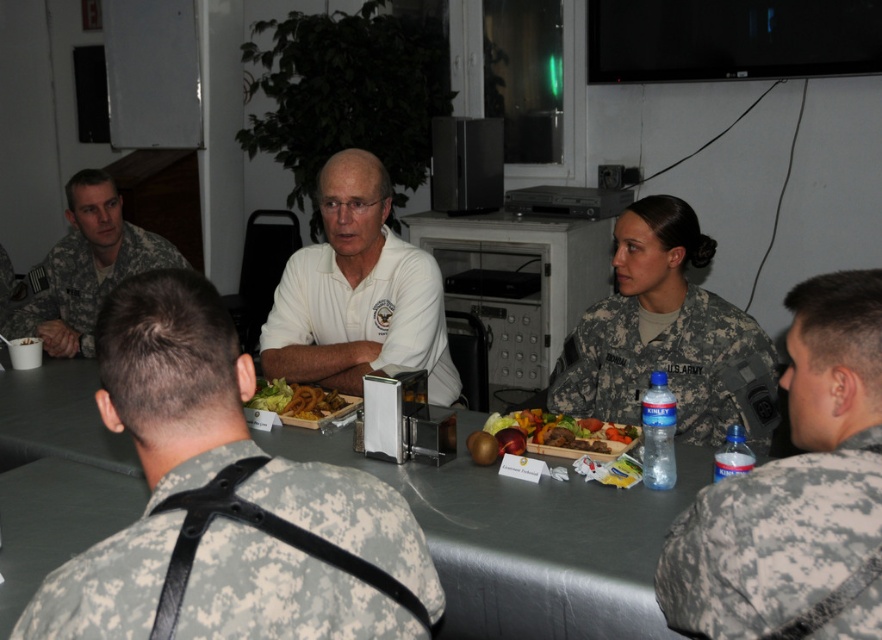
You are a photographer positioned to the side of the table. You need to capture a photo where both the camouflage fabric uniform at left and the golden crispy fries at center are clearly visible. Considering their heights, which object should be placed closer to the camera to ensure both are in focus?

The camouflage fabric uniform at left is taller than the golden crispy fries at center. To ensure both are in focus, position the camouflage fabric uniform at left closer to the camera so its height aligns with the golden crispy fries at center.

You are a member of the military unit seated at the table. You need to pass a document from point A to point B. Point A is at coordinate point(x=28, y=300) and point B is at coordinate point(x=318, y=396). Based on the spatial relationship between these two points, which direction should you move the document to ensure it reaches the correct location?

Since point(x=28, y=300) is behind point(x=318, y=396), you should move the document forward towards point(x=318, y=396) to ensure it reaches the correct location.

You are standing at the point marked by the coordinates point (527, 540). What is the object located directly beneath this point?

The object located directly beneath point (527, 540) is the gray matte table at center.